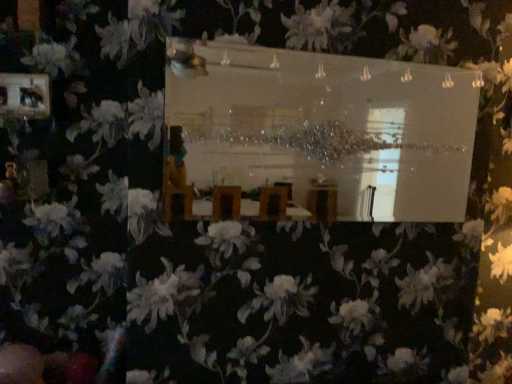
Where is `matte black picture frame at upper left`? The height and width of the screenshot is (384, 512). matte black picture frame at upper left is located at coordinates (24, 95).

Describe the element at coordinates (24, 95) in the screenshot. I see `matte black picture frame at upper left` at that location.

The height and width of the screenshot is (384, 512). What are the coordinates of `clear glass mirror at center` in the screenshot? It's located at click(x=329, y=128).

This screenshot has width=512, height=384. What do you see at coordinates (329, 128) in the screenshot? I see `clear glass mirror at center` at bounding box center [329, 128].

You are a GUI agent. You are given a task and a screenshot of the screen. Output one action in this format:
    pyautogui.click(x=<x>, y=<y>)
    Task: Click on the matte black picture frame at upper left
    This screenshot has width=512, height=384.
    Given the screenshot: What is the action you would take?
    pyautogui.click(x=24, y=95)

Which object is positioned more to the right, matte black picture frame at upper left or clear glass mirror at center?

From the viewer's perspective, clear glass mirror at center appears more on the right side.

Is the position of matte black picture frame at upper left more distant than that of clear glass mirror at center?

Yes, matte black picture frame at upper left is further from the viewer.

Which is more distant, (38, 118) or (450, 105)?

The point (450, 105) is farther from the camera.

From the image's perspective, is matte black picture frame at upper left above or below clear glass mirror at center?

Clearly, from the image's perspective, matte black picture frame at upper left is above clear glass mirror at center.

From a real-world perspective, is matte black picture frame at upper left located beneath clear glass mirror at center?

Incorrect, from a real-world perspective, matte black picture frame at upper left is higher than clear glass mirror at center.

Between matte black picture frame at upper left and clear glass mirror at center, which one has smaller width?

With smaller width is matte black picture frame at upper left.

Does matte black picture frame at upper left have a lesser height compared to clear glass mirror at center?

Indeed, matte black picture frame at upper left has a lesser height compared to clear glass mirror at center.

Between matte black picture frame at upper left and clear glass mirror at center, which one has larger size?

clear glass mirror at center is bigger.

Which is correct: matte black picture frame at upper left is inside clear glass mirror at center, or outside of it?

matte black picture frame at upper left exists outside the volume of clear glass mirror at center.

Are matte black picture frame at upper left and clear glass mirror at center located far from each other?

Indeed, matte black picture frame at upper left is not near clear glass mirror at center.

Consider the image. Is clear glass mirror at center at the back of matte black picture frame at upper left?

No, matte black picture frame at upper left is not facing the opposite direction of clear glass mirror at center.

Can you tell me how much matte black picture frame at upper left and clear glass mirror at center differ in facing direction?

0.0215 degrees.

Locate an element on the screen. The height and width of the screenshot is (384, 512). mirror that appears below the matte black picture frame at upper left (from a real-world perspective) is located at coordinates (329, 128).

Would you say clear glass mirror at center is to the left or to the right of matte black picture frame at upper left in the picture?

clear glass mirror at center is to the right of matte black picture frame at upper left.

Is clear glass mirror at center in front of or behind matte black picture frame at upper left in the image?

clear glass mirror at center is in front of matte black picture frame at upper left.

Which is less distant, (x=338, y=79) or (x=19, y=99)?

Point (x=338, y=79) appears to be closer to the viewer than point (x=19, y=99).

From the image's perspective, is clear glass mirror at center located beneath matte black picture frame at upper left?

Indeed, from the image's perspective, clear glass mirror at center is shown beneath matte black picture frame at upper left.

From a real-world perspective, is clear glass mirror at center physically below matte black picture frame at upper left?

Correct, in the physical world, clear glass mirror at center is lower than matte black picture frame at upper left.

Which object is thinner, clear glass mirror at center or matte black picture frame at upper left?

matte black picture frame at upper left is thinner.

Considering the sizes of objects clear glass mirror at center and matte black picture frame at upper left in the image provided, who is taller, clear glass mirror at center or matte black picture frame at upper left?

Standing taller between the two is clear glass mirror at center.

Which of these two, clear glass mirror at center or matte black picture frame at upper left, is bigger?

Bigger between the two is clear glass mirror at center.

Is clear glass mirror at center not inside matte black picture frame at upper left?

Absolutely, clear glass mirror at center is external to matte black picture frame at upper left.

Is clear glass mirror at center positioned far away from matte black picture frame at upper left?

Absolutely, clear glass mirror at center is distant from matte black picture frame at upper left.

Could you tell me if clear glass mirror at center is facing matte black picture frame at upper left?

No, clear glass mirror at center is not aimed at matte black picture frame at upper left.

What's the angular difference between clear glass mirror at center and matte black picture frame at upper left's facing directions?

The facing directions of clear glass mirror at center and matte black picture frame at upper left are 0.0215 degrees apart.

Measure the distance from clear glass mirror at center to matte black picture frame at upper left.

clear glass mirror at center and matte black picture frame at upper left are 3.14 meters apart from each other.

You are a GUI agent. You are given a task and a screenshot of the screen. Output one action in this format:
    pyautogui.click(x=<x>, y=<y>)
    Task: Click on the mirror in front of the matte black picture frame at upper left
    The height and width of the screenshot is (384, 512).
    Given the screenshot: What is the action you would take?
    pyautogui.click(x=329, y=128)

Find the location of a particular element. mirror that appears on the right of matte black picture frame at upper left is located at coordinates [x=329, y=128].

Where is `mirror that appears below the matte black picture frame at upper left (from the image's perspective)`? The height and width of the screenshot is (384, 512). mirror that appears below the matte black picture frame at upper left (from the image's perspective) is located at coordinates (329, 128).